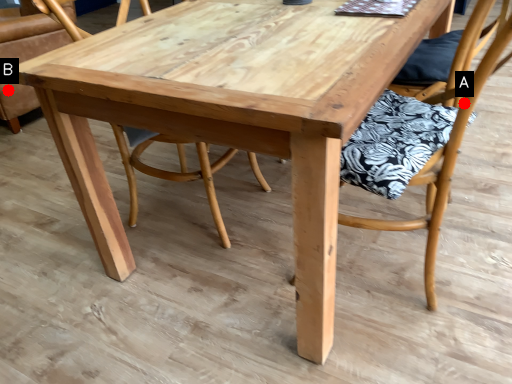
Question: Two points are circled on the image, labeled by A and B beside each circle. Which point is further to the camera?

Choices:
 (A) A is further
 (B) B is further

Answer: (B)